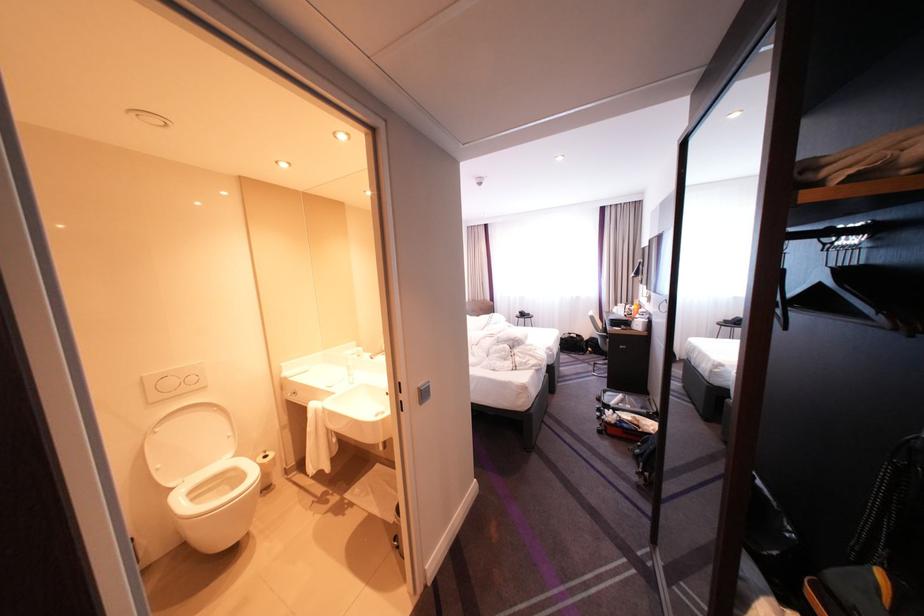
The image size is (924, 616). I want to click on silver light switch, so click(x=423, y=392).